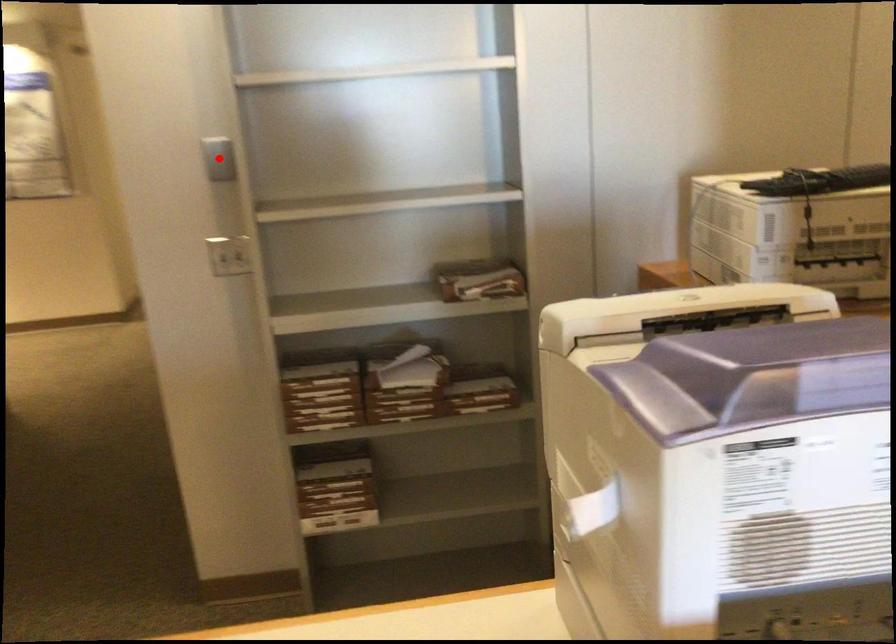
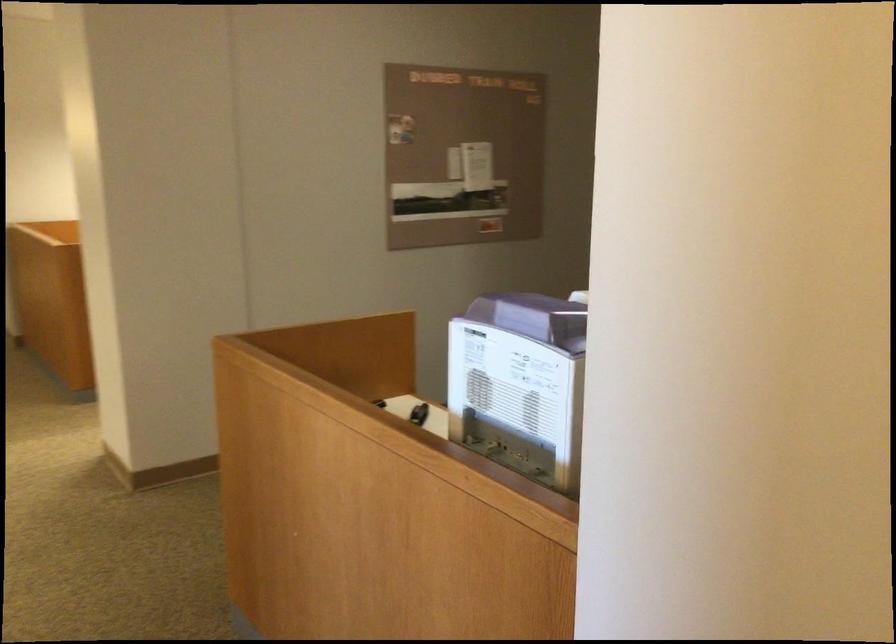
Question: I am providing you with two images of the same scene from different viewpoints. A red point is marked on the first image. Is the red point's position out of view in image 2?

Choices:
 (A) Yes
 (B) No

Answer: (A)